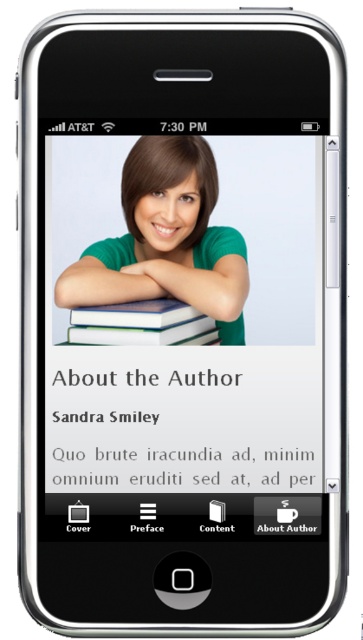
What are the coordinates of the black paper text at center?

The coordinates of the black paper text at center are at point (184, 422).

You are a graphic designer reviewing the layout of this smartphone screen. You need to determine if the black paper text at center will fit within the height of the green matte shirt at center in the image. Can you confirm this?

The black paper text at center has a lesser height compared to green matte shirt at center, so it will fit within the height of the green matte shirt at center.